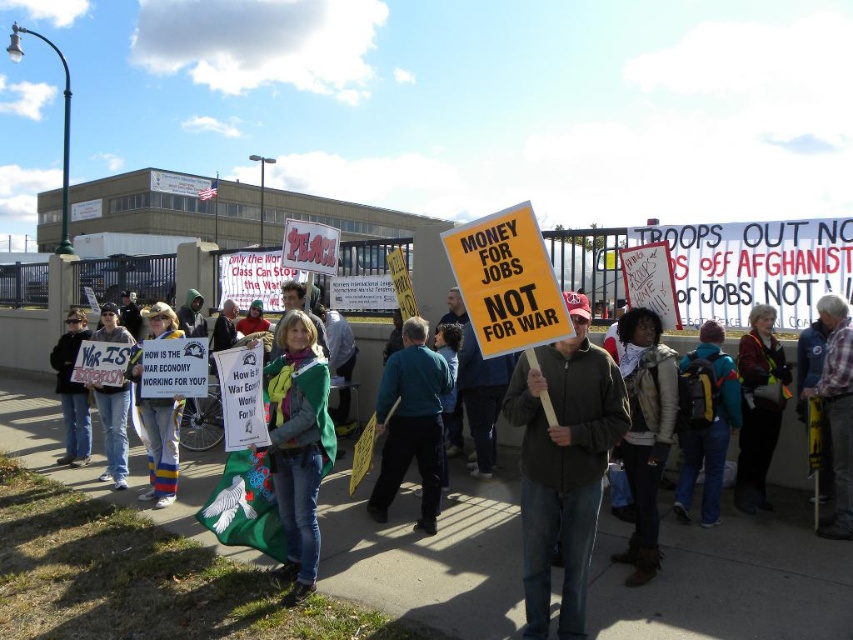
You are a photographer trying to capture a clear photo of both the maroon fabric jacket at center and the plaid shirt at center. Since you want both subjects to be fully visible in the frame, which clothing item should you focus on first to ensure it fits in the photo?

The maroon fabric jacket at center is not as tall as plaid shirt at center, so you should focus on framing the taller plaid shirt at center first to ensure it fits in the photo, and then adjust the shot to include the shorter maroon fabric jacket at center.

You are a photographer standing at the edge of the protest crowd. You want to take a photo of both the blue fleece jacket at center and the plaid shirt at center. Which one should you focus on first to ensure both are in the frame?

The blue fleece jacket at center is located below the plaid shirt at center, so you should focus on the plaid shirt at center first to ensure both are in the frame.